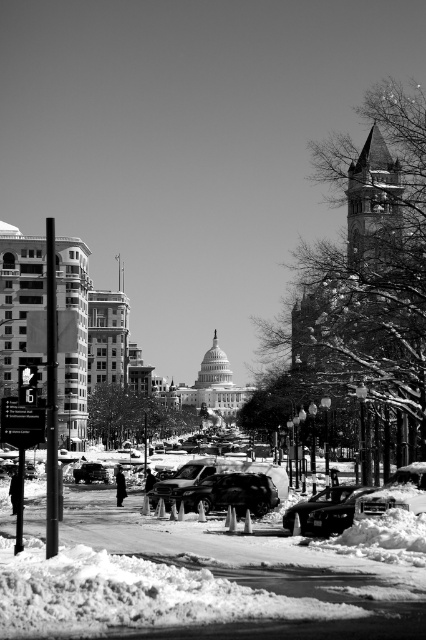
Is point (351, 496) less distant than point (92, 481)?

Yes, point (351, 496) is closer to viewer.

Between point (373, 488) and point (80, 480), which one is positioned in front?

Point (373, 488) is more forward.

Where is `shiny black sedan at center`? The height and width of the screenshot is (640, 426). shiny black sedan at center is located at coordinates (325, 509).

Is shiny black suv at center wider than shiny silver sedan at lower left?

Indeed, shiny black suv at center has a greater width compared to shiny silver sedan at lower left.

The width and height of the screenshot is (426, 640). I want to click on shiny black suv at center, so click(230, 493).

Identify the location of shiny black suv at center. (230, 493).

Who is shorter, shiny black suv at center or shiny black sedan at center?

Standing shorter between the two is shiny black sedan at center.

Find the location of `shiny black suv at center`. shiny black suv at center is located at coordinates (230, 493).